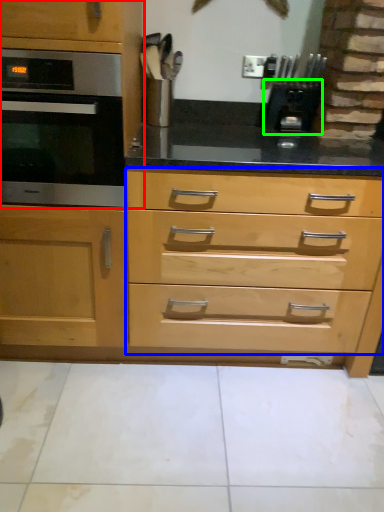
Question: Based on their relative distances, which object is farther from cabinetry (highlighted by a red box)? Choose from drawer (highlighted by a blue box) and appliance (highlighted by a green box).

Choices:
 (A) drawer
 (B) appliance

Answer: (B)